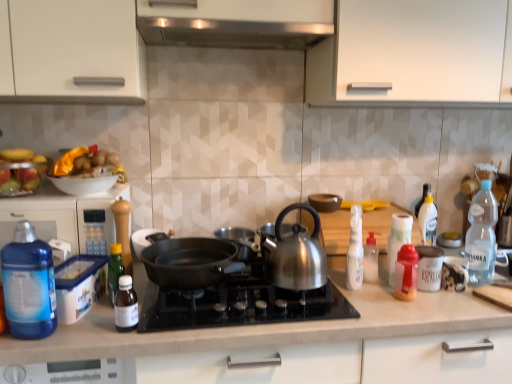
The width and height of the screenshot is (512, 384). What do you see at coordinates (429, 268) in the screenshot? I see `white plastic espresso cup at right, marked as the 4th kitchen appliance in a left-to-right arrangement` at bounding box center [429, 268].

How much space does cast iron pan at center, the 1th kitchen appliance in the left-to-right sequence, occupy vertically?

cast iron pan at center, the 1th kitchen appliance in the left-to-right sequence, is 3.96 inches in height.

What is the approximate width of cast iron pan at center, which ranks as the fourth kitchen appliance in right-to-left order?

cast iron pan at center, which ranks as the fourth kitchen appliance in right-to-left order, is 40.33 centimeters wide.

Describe the element at coordinates (370, 259) in the screenshot. Image resolution: width=512 pixels, height=384 pixels. I see `white plastic bottle at right, placed as the 5th bottle when sorted from left to right` at that location.

Measure the distance between point (153, 14) and camera.

A distance of 4.16 feet exists between point (153, 14) and camera.

The width and height of the screenshot is (512, 384). What do you see at coordinates (29, 284) in the screenshot?
I see `blue translucent bottle at left, marked as the 1th bottle in a left-to-right arrangement` at bounding box center [29, 284].

What do you see at coordinates (355, 251) in the screenshot? This screenshot has width=512, height=384. I see `white plastic spray bottle at center-right, placed as the fifth bottle when sorted from right to left` at bounding box center [355, 251].

Identify the location of shiny metallic kettle at center, acting as the 2th kitchen appliance starting from the left. (296, 254).

Is white plastic espresso cup at right, marked as the 4th kitchen appliance in a left-to-right arrangement, positioned before translucent plastic bottle at lower left, the third bottle viewed from the left?

No, it is not.

From the image's perspective, would you say white plastic espresso cup at right, positioned as the 1th kitchen appliance in right-to-left order, is positioned over translucent plastic bottle at lower left, marked as the sixth bottle in a right-to-left arrangement?

Yes, from the image's perspective, white plastic espresso cup at right, positioned as the 1th kitchen appliance in right-to-left order, is on top of translucent plastic bottle at lower left, marked as the sixth bottle in a right-to-left arrangement.

How many degrees apart are the facing directions of white plastic espresso cup at right, marked as the 4th kitchen appliance in a left-to-right arrangement, and translucent plastic bottle at lower left, the third bottle viewed from the left?

The angular difference between white plastic espresso cup at right, marked as the 4th kitchen appliance in a left-to-right arrangement, and translucent plastic bottle at lower left, the third bottle viewed from the left, is 3.58 degrees.

Can you confirm if white plastic espresso cup at right, positioned as the 1th kitchen appliance in right-to-left order, is smaller than translucent plastic bottle at lower left, the third bottle viewed from the left?

Actually, white plastic espresso cup at right, positioned as the 1th kitchen appliance in right-to-left order, might be larger than translucent plastic bottle at lower left, the third bottle viewed from the left.

Is point (376, 278) farther from camera compared to point (118, 297)?

Yes, it is.

Considering the sizes of objects white plastic bottle at right, placed as the 5th bottle when sorted from left to right, and translucent plastic bottle at lower left, the third bottle viewed from the left, in the image provided, who is shorter, white plastic bottle at right, placed as the 5th bottle when sorted from left to right, or translucent plastic bottle at lower left, the third bottle viewed from the left,?

Standing shorter between the two is translucent plastic bottle at lower left, the third bottle viewed from the left.

Would you say white plastic bottle at right, which ranks as the fourth bottle in right-to-left order, is inside or outside translucent plastic bottle at lower left, the third bottle viewed from the left?

The correct answer is: outside.

Which is nearer, (91, 14) or (181, 240)?

The point (91, 14) is in front.

Considering the sizes of objects white matte cabinet at upper center and cast iron pan at center, which ranks as the fourth kitchen appliance in right-to-left order, in the image provided, who is taller, white matte cabinet at upper center or cast iron pan at center, which ranks as the fourth kitchen appliance in right-to-left order,?

With more height is white matte cabinet at upper center.

Could you tell me if white matte cabinet at upper center is facing cast iron pan at center, which ranks as the fourth kitchen appliance in right-to-left order?

No, white matte cabinet at upper center is not oriented towards cast iron pan at center, which ranks as the fourth kitchen appliance in right-to-left order.

Considering their positions, is white matte cabinet at upper center located in front of or behind cast iron pan at center, which ranks as the fourth kitchen appliance in right-to-left order?

Visually, white matte cabinet at upper center is located behind cast iron pan at center, which ranks as the fourth kitchen appliance in right-to-left order.

How different are the orientations of white plastic espresso cup at right, positioned as the 1th kitchen appliance in right-to-left order, and satin silver exhaust hood at upper center in degrees?

There is a 3.43-degree angle between the facing directions of white plastic espresso cup at right, positioned as the 1th kitchen appliance in right-to-left order, and satin silver exhaust hood at upper center.

Could you tell me if white plastic espresso cup at right, marked as the 4th kitchen appliance in a left-to-right arrangement, is turned towards satin silver exhaust hood at upper center?

No, white plastic espresso cup at right, marked as the 4th kitchen appliance in a left-to-right arrangement, does not turn towards satin silver exhaust hood at upper center.

From the image's perspective, which is below, white plastic espresso cup at right, positioned as the 1th kitchen appliance in right-to-left order, or satin silver exhaust hood at upper center?

Result: white plastic espresso cup at right, positioned as the 1th kitchen appliance in right-to-left order, appears lower in the image.

From the image's perspective, does cast iron pan at center, which ranks as the fourth kitchen appliance in right-to-left order, appear lower than transparent plastic bottle at right, the 8th bottle positioned from the left?

Yes, from the image's perspective, cast iron pan at center, which ranks as the fourth kitchen appliance in right-to-left order, is beneath transparent plastic bottle at right, the 8th bottle positioned from the left.

Is cast iron pan at center, the 1th kitchen appliance in the left-to-right sequence, looking in the opposite direction of transparent plastic bottle at right, which is counted as the 1th bottle, starting from the right?

cast iron pan at center, the 1th kitchen appliance in the left-to-right sequence, is not turned away from transparent plastic bottle at right, which is counted as the 1th bottle, starting from the right.

Which of these two, cast iron pan at center, the 1th kitchen appliance in the left-to-right sequence, or transparent plastic bottle at right, the 8th bottle positioned from the left, stands shorter?

cast iron pan at center, the 1th kitchen appliance in the left-to-right sequence.

Between cast iron pan at center, the 1th kitchen appliance in the left-to-right sequence, and transparent plastic bottle at right, which is counted as the 1th bottle, starting from the right, which one appears on the left side from the viewer's perspective?

Positioned to the left is cast iron pan at center, the 1th kitchen appliance in the left-to-right sequence.

Does point (473, 264) come in front of point (7, 169)?

No, it is not.

From a real-world perspective, count 1st foods upward from the transparent plastic bottle at right, which is counted as the 1th bottle, starting from the right, and point to it. Please provide its 2D coordinates.

[(20, 171)]

From the image's perspective, which is above, transparent plastic bottle at right, which is counted as the 1th bottle, starting from the right, or translucent plastic fruit bowl at left, the first food positioned from the left?

translucent plastic fruit bowl at left, the first food positioned from the left, is shown above in the image.

Which is correct: transparent plastic bottle at right, which is counted as the 1th bottle, starting from the right, is inside translucent plastic fruit bowl at left, the second food from the right, or outside of it?

transparent plastic bottle at right, which is counted as the 1th bottle, starting from the right, is not inside translucent plastic fruit bowl at left, the second food from the right, it's outside.

You are a GUI agent. You are given a task and a screenshot of the screen. Output one action in this format:
    pyautogui.click(x=<x>, y=<y>)
    Task: Click on the 2nd bottle counting from the right of the brown matte bowl at center, marked as the 3th kitchen appliance in a left-to-right arrangement
    The height and width of the screenshot is (384, 512).
    Given the screenshot: What is the action you would take?
    pyautogui.click(x=370, y=259)

Is brown matte bowl at center, positioned as the 2th kitchen appliance in right-to-left order, facing towards white plastic bottle at right, which ranks as the fourth bottle in right-to-left order?

No, brown matte bowl at center, positioned as the 2th kitchen appliance in right-to-left order, is not oriented towards white plastic bottle at right, which ranks as the fourth bottle in right-to-left order.

Which is more to the left, brown matte bowl at center, marked as the 3th kitchen appliance in a left-to-right arrangement, or white plastic bottle at right, which ranks as the fourth bottle in right-to-left order?

brown matte bowl at center, marked as the 3th kitchen appliance in a left-to-right arrangement.

Locate an element on the screen. The width and height of the screenshot is (512, 384). bottle below the white plastic espresso cup at right, positioned as the 1th kitchen appliance in right-to-left order (from the image's perspective) is located at coordinates (126, 305).

The width and height of the screenshot is (512, 384). In order to click on bottle that appears below the white plastic bottle at right, which ranks as the fourth bottle in right-to-left order (from a real-world perspective) in this screenshot , I will do `click(126, 305)`.

Consider the image. Considering their positions, is brown matte bowl at center, positioned as the 2th kitchen appliance in right-to-left order, positioned closer to green glass bottle at left, which ranks as the 2th bottle in left-to-right order, than white matte cabinet at upper center?

brown matte bowl at center, positioned as the 2th kitchen appliance in right-to-left order, is positioned closer to the anchor green glass bottle at left, which ranks as the 2th bottle in left-to-right order.

Based on their spatial positions, is translucent plastic bottle at right, the sixth bottle positioned from the left, or transparent plastic bottle at right, the 8th bottle positioned from the left, further from white plastic spray bottle at center-right, arranged as the fourth bottle when viewed from the left?

transparent plastic bottle at right, the 8th bottle positioned from the left, is further to white plastic spray bottle at center-right, arranged as the fourth bottle when viewed from the left.

From the image, which object appears to be farther from yellow paper wrapped potatoes at upper left, the second food from the left, white plastic espresso cup at right, positioned as the 1th kitchen appliance in right-to-left order, or translucent plastic fruit bowl at left, the second food from the right?

Based on the image, white plastic espresso cup at right, positioned as the 1th kitchen appliance in right-to-left order, appears to be further to yellow paper wrapped potatoes at upper left, the second food from the left.

Looking at this image, considering their positions, is white plastic bottle at right, placed as the 5th bottle when sorted from left to right, positioned further to white plastic bottle at right, the second bottle from the right, than satin silver exhaust hood at upper center?

satin silver exhaust hood at upper center.

From the image, which object appears to be nearer to translucent plastic fruit bowl at left, the first food positioned from the left, shiny metallic kettle at center, which appears as the 3th kitchen appliance when viewed from the right, or black matte pan at center?

Based on the image, black matte pan at center appears to be nearer to translucent plastic fruit bowl at left, the first food positioned from the left.

From the image, which object appears to be nearer to translucent plastic fruit bowl at left, the second food from the right, translucent plastic bottle at lower left, marked as the sixth bottle in a right-to-left arrangement, or blue plastic container at left?

blue plastic container at left.

Looking at the image, which one is located further to shiny metallic kettle at center, which appears as the 3th kitchen appliance when viewed from the right, translucent plastic bottle at right, positioned as the third bottle in right-to-left order, or white plastic bottle at right, which is the 7th bottle in left-to-right order?

Among the two, white plastic bottle at right, which is the 7th bottle in left-to-right order, is located further to shiny metallic kettle at center, which appears as the 3th kitchen appliance when viewed from the right.

In the scene shown: Which object lies further to the anchor point brown matte bowl at center, positioned as the 2th kitchen appliance in right-to-left order, white glossy bowl at upper left or translucent plastic bottle at right, positioned as the third bottle in right-to-left order?

Among the two, white glossy bowl at upper left is located further to brown matte bowl at center, positioned as the 2th kitchen appliance in right-to-left order.

Locate an element on the screen. The height and width of the screenshot is (384, 512). food between blue plastic container at left and shiny metallic kettle at center, which appears as the 3th kitchen appliance when viewed from the right, from left to right is located at coordinates (89, 163).

I want to click on exhaust hood between blue plastic container at left and white plastic bottle at right, which ranks as the fourth bottle in right-to-left order, from left to right, so click(237, 23).

Where is `bowl between yellow paper wrapped potatoes at upper left, the second food from the left, and white plastic bottle at right, placed as the 5th bottle when sorted from left to right`? The image size is (512, 384). bowl between yellow paper wrapped potatoes at upper left, the second food from the left, and white plastic bottle at right, placed as the 5th bottle when sorted from left to right is located at coordinates click(84, 184).

Where is `gas stove situated between blue plastic container at left and white plastic spray bottle at center-right, placed as the fifth bottle when sorted from right to left, from left to right`? gas stove situated between blue plastic container at left and white plastic spray bottle at center-right, placed as the fifth bottle when sorted from right to left, from left to right is located at coordinates click(239, 304).